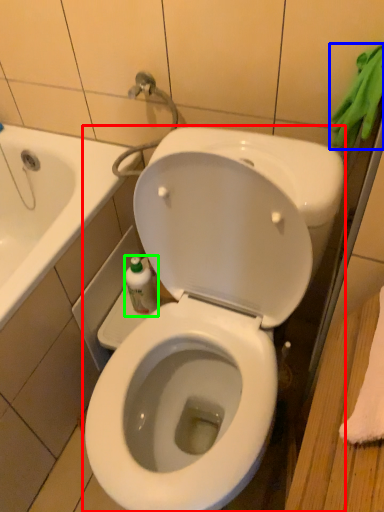
Question: Estimate the real-world distances between objects in this image. Which object is farther from toilet (highlighted by a red box), bath towel (highlighted by a blue box) or bottle (highlighted by a green box)?

Choices:
 (A) bath towel
 (B) bottle

Answer: (A)